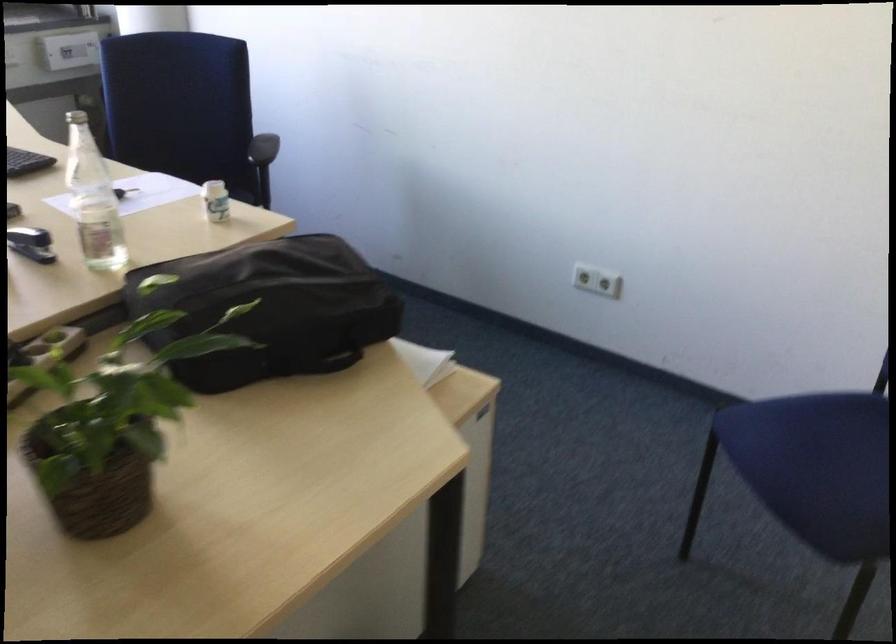
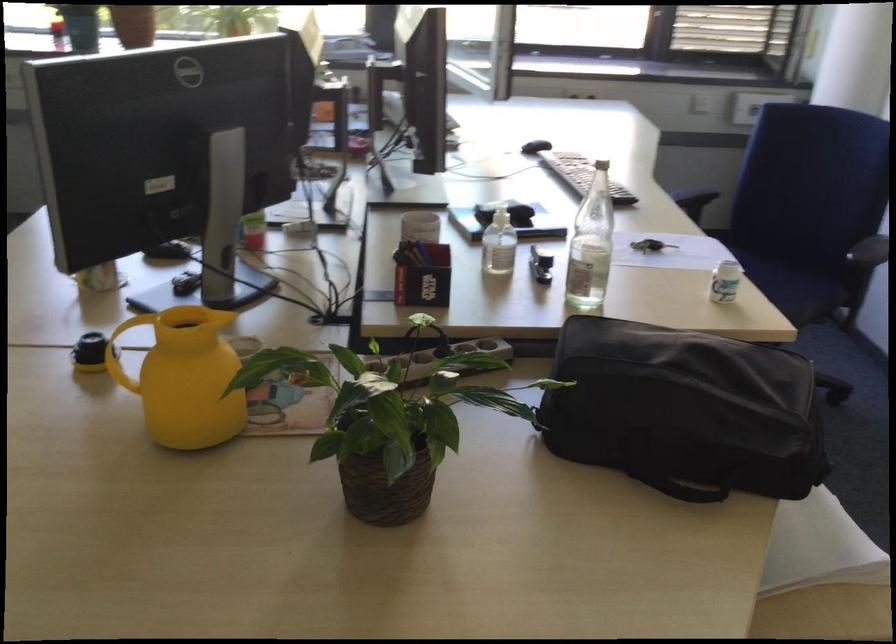
Find the pixel in the second image that matches point (125, 486) in the first image.

(383, 484)